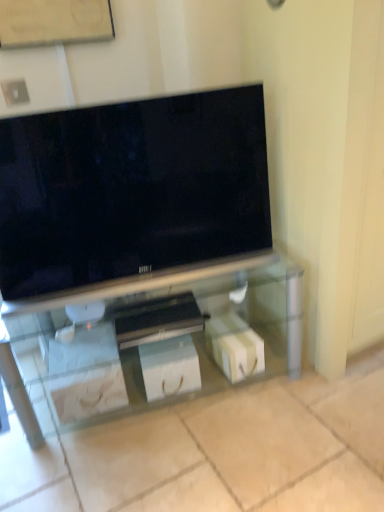
Question: Does wooden bulletin board at upper center have a larger size compared to white glossy box at center, which ranks as the 2th box in left-to-right order?

Choices:
 (A) yes
 (B) no

Answer: (B)

Question: From the image's perspective, is wooden bulletin board at upper center on top of white glossy box at center, the first box in the right-to-left sequence?

Choices:
 (A) yes
 (B) no

Answer: (A)

Question: Does wooden bulletin board at upper center have a greater width compared to white glossy box at center, the first box in the right-to-left sequence?

Choices:
 (A) no
 (B) yes

Answer: (A)

Question: Is wooden bulletin board at upper center turned away from white glossy box at center, the first box in the right-to-left sequence?

Choices:
 (A) yes
 (B) no

Answer: (B)

Question: Is the position of wooden bulletin board at upper center less distant than that of white glossy box at center, which ranks as the 2th box in left-to-right order?

Choices:
 (A) no
 (B) yes

Answer: (B)

Question: Is point (62, 294) closer or farther from the camera than point (29, 29)?

Choices:
 (A) closer
 (B) farther

Answer: (B)

Question: Is clear glass tv stand at center in front of or behind wooden bulletin board at upper center in the image?

Choices:
 (A) front
 (B) behind

Answer: (A)

Question: Considering the positions of clear glass tv stand at center and wooden bulletin board at upper center in the image, is clear glass tv stand at center taller or shorter than wooden bulletin board at upper center?

Choices:
 (A) tall
 (B) short

Answer: (A)

Question: From the image's perspective, is clear glass tv stand at center positioned above or below wooden bulletin board at upper center?

Choices:
 (A) below
 (B) above

Answer: (A)

Question: In the image, is wooden bulletin board at upper center positioned in front of or behind clear glass tv stand at center?

Choices:
 (A) behind
 (B) front

Answer: (A)

Question: Considering the positions of wooden bulletin board at upper center and clear glass tv stand at center in the image, is wooden bulletin board at upper center wider or thinner than clear glass tv stand at center?

Choices:
 (A) thin
 (B) wide

Answer: (A)

Question: From the image's perspective, is wooden bulletin board at upper center positioned above or below clear glass tv stand at center?

Choices:
 (A) below
 (B) above

Answer: (B)

Question: From a real-world perspective, relative to clear glass tv stand at center, is wooden bulletin board at upper center vertically above or below?

Choices:
 (A) below
 (B) above

Answer: (B)

Question: Considering the relative positions of white glossy box at center, which ranks as the 2th box in left-to-right order, and matte black tv at center in the image provided, is white glossy box at center, which ranks as the 2th box in left-to-right order, to the left or to the right of matte black tv at center?

Choices:
 (A) right
 (B) left

Answer: (A)

Question: Does point (210, 327) appear closer or farther from the camera than point (102, 199)?

Choices:
 (A) farther
 (B) closer

Answer: (A)